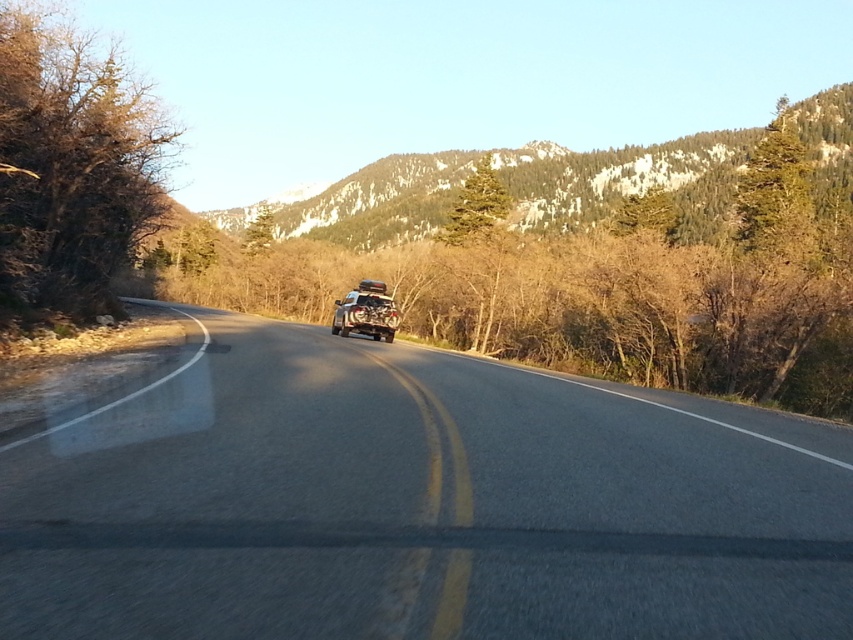
You are standing at the point with coordinates [405,499] in the image. Based on the scene description, what surface are you currently standing on?

The point at [405,499] corresponds to the asphalt road at center, so you are standing on the asphalt road at center.

You are a driver planning to overtake the metallic silver jeep at center on the asphalt road at center. The road has a double yellow line, which means passing is prohibited. Considering the distance between the jeep and the road, can you safely overtake the vehicle without crossing the double yellow line?

The distance between the asphalt road at center and metallic silver jeep at center is 56.70 feet. However, the double yellow line indicates that passing is not allowed. Therefore, you cannot safely overtake the metallic silver jeep at center without violating traffic rules.

You are driving a car and see the green textured mountain at upper center and the metallic silver jeep at center. Which one is closer to you?

The metallic silver jeep at center is behind the green textured mountain at upper center, so the green textured mountain at upper center is closer to you.